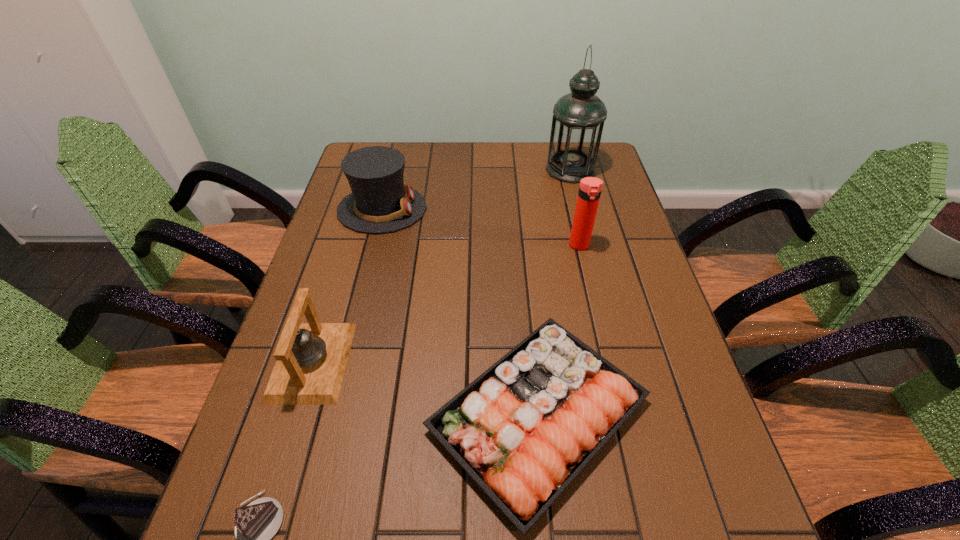
Locate an element on the screen. object located in the far edge section of the desktop is located at coordinates (578, 118).

Where is `dress hat that is at the left edge`? Image resolution: width=960 pixels, height=540 pixels. dress hat that is at the left edge is located at coordinates (379, 203).

Where is `bell positioned at the left edge`? The width and height of the screenshot is (960, 540). bell positioned at the left edge is located at coordinates (311, 358).

Identify the location of oil lamp that is at the right edge. The height and width of the screenshot is (540, 960). [x=578, y=118].

Where is `thermos bottle at the right edge`? thermos bottle at the right edge is located at coordinates (590, 188).

The width and height of the screenshot is (960, 540). I want to click on object that is at the far right corner, so click(x=578, y=118).

This screenshot has width=960, height=540. In the image, there is a desktop. Find the location of `vacant region at the far edge`. vacant region at the far edge is located at coordinates (500, 145).

The width and height of the screenshot is (960, 540). In the image, there is a desktop. What are the coordinates of `vacant space at the near edge` in the screenshot? It's located at (x=563, y=532).

This screenshot has width=960, height=540. In order to click on vacant space at the left edge in this screenshot , I will do `click(337, 303)`.

Where is `vacant space at the right edge of the desktop`? Image resolution: width=960 pixels, height=540 pixels. vacant space at the right edge of the desktop is located at coordinates (633, 291).